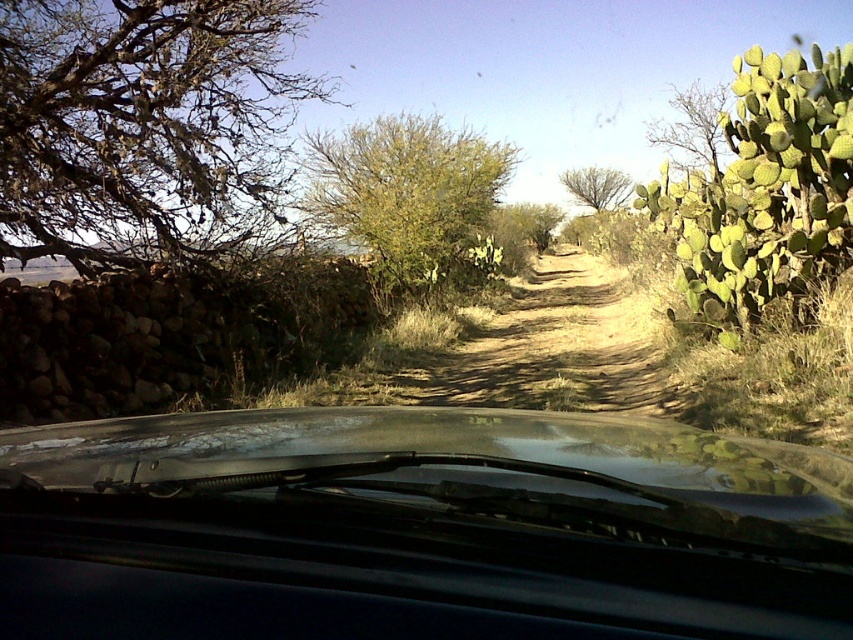
Does brown/dry wood tree at left have a lesser width compared to brown leafy tree at center?

Yes.

Between brown/dry wood tree at left and brown leafy tree at center, which one has more height?

brown leafy tree at center

The height and width of the screenshot is (640, 853). Describe the element at coordinates (142, 124) in the screenshot. I see `brown/dry wood tree at left` at that location.

Where is `brown/dry wood tree at left`? The height and width of the screenshot is (640, 853). brown/dry wood tree at left is located at coordinates (142, 124).

Can you confirm if transparent glass windshield at center is taller than brown/dry wood tree at left?

Correct, transparent glass windshield at center is much taller as brown/dry wood tree at left.

At what (x,y) coordinates should I click in order to perform the action: click on transparent glass windshield at center. Please return your answer as a coordinate pair (x, y). The height and width of the screenshot is (640, 853). Looking at the image, I should click on coord(418,529).

Is green spiny cactus at right shorter than brown dirt track at center?

No.

Can you confirm if green spiny cactus at right is taller than brown dirt track at center?

Yes, green spiny cactus at right is taller than brown dirt track at center.

Locate an element on the screen. The height and width of the screenshot is (640, 853). green spiny cactus at right is located at coordinates (764, 189).